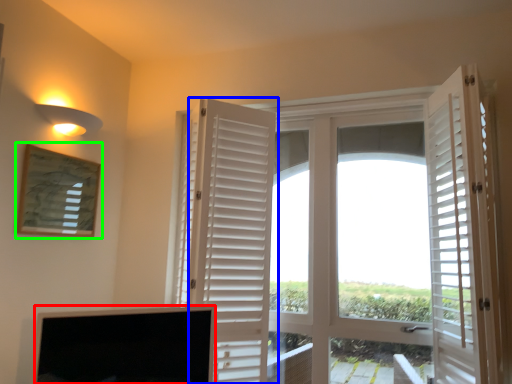
Question: Based on their relative distances, which object is nearer to screen (highlighted by a red box)? Choose from door (highlighted by a blue box) and picture frame (highlighted by a green box).

Choices:
 (A) door
 (B) picture frame

Answer: (A)